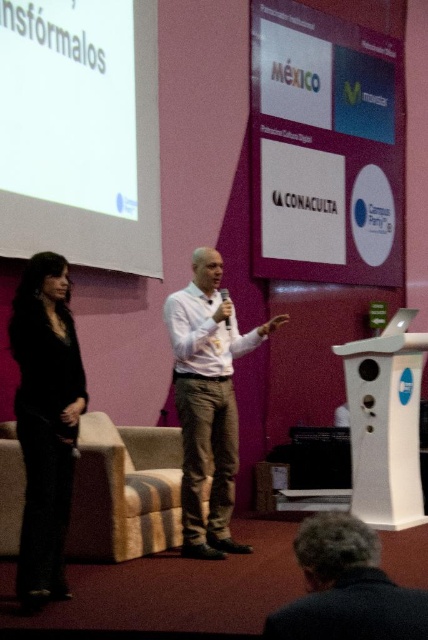
Which is more to the left, white paper at upper center or dark brown hair at lower center?

From the viewer's perspective, dark brown hair at lower center appears more on the left side.

Between point (290, 211) and point (332, 579), which one is positioned in front?

Positioned in front is point (332, 579).

This screenshot has width=428, height=640. Find the location of `white paper at upper center`. white paper at upper center is located at coordinates (326, 147).

Does white shirt at center appear on the right side of dark brown hair at lower center?

In fact, white shirt at center is to the left of dark brown hair at lower center.

Is point (231, 324) closer to camera compared to point (321, 524)?

No, it is not.

This screenshot has width=428, height=640. Identify the location of white shirt at center. (208, 401).

Is point (20, 289) positioned after point (190, 468)?

No.

Does black matte pants at left have a lesser width compared to white shirt at center?

Yes.

Between point (24, 448) and point (198, 531), which one is positioned behind?

Point (198, 531)

Identify the location of black matte pants at left. (45, 420).